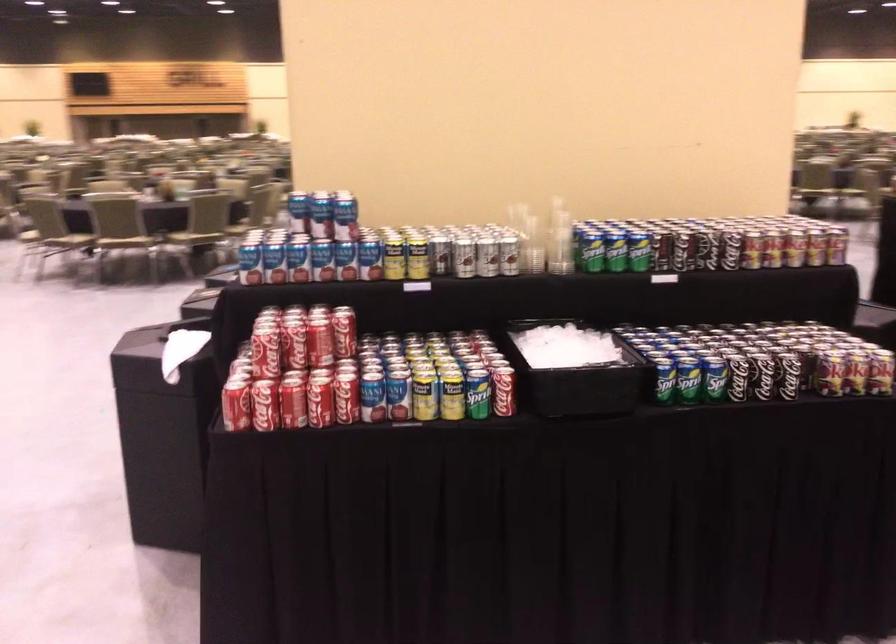
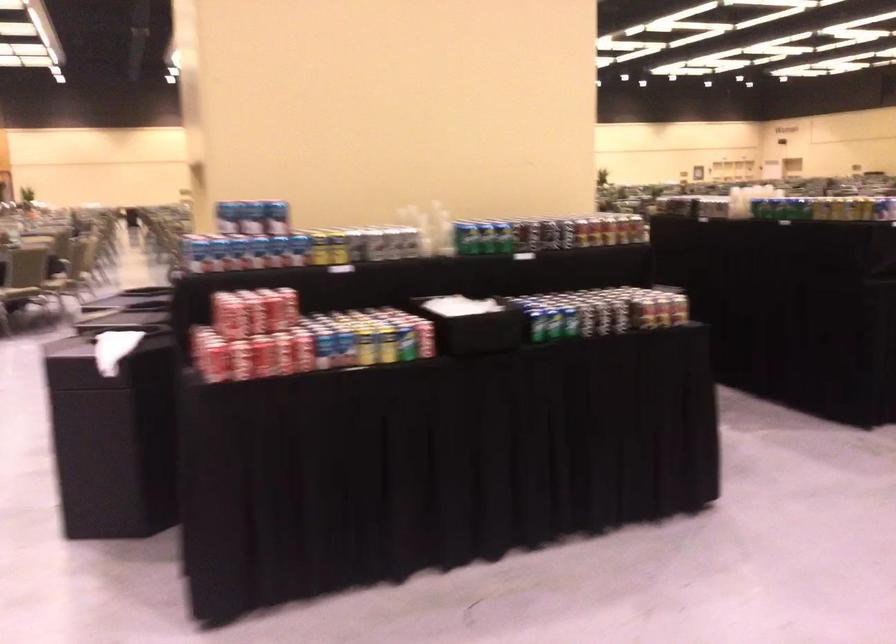
The point at (347, 219) is marked in the first image. Where is the corresponding point in the second image?

(277, 218)